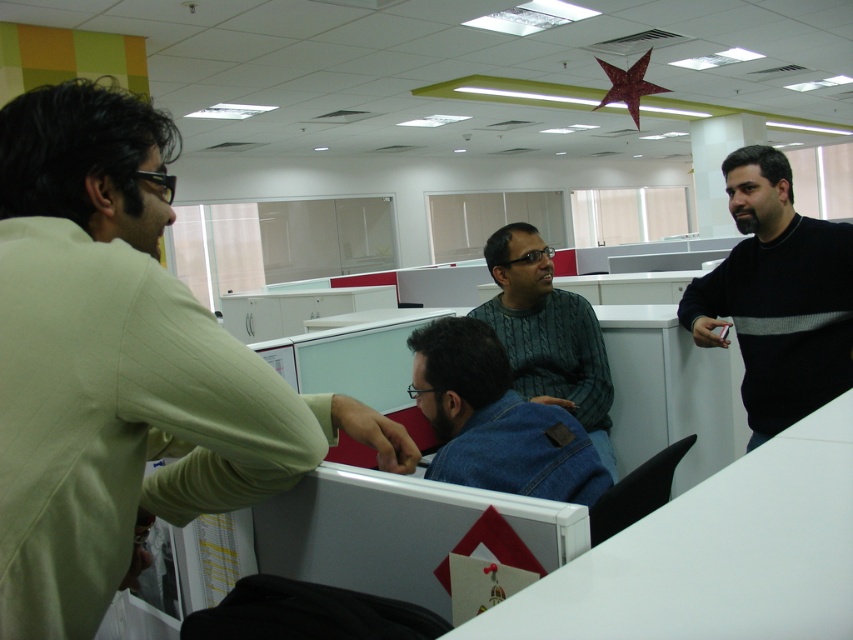
Question: Which of the following is the closest to the observer?

Choices:
 (A) (142, 378)
 (B) (807, 227)

Answer: (A)

Question: Does denim jacket at center appear on the left side of green knitted sweater at center?

Choices:
 (A) no
 (B) yes

Answer: (B)

Question: Which object is the farthest from the black sweater at right?

Choices:
 (A) light beige shirt at left
 (B) green knitted sweater at center

Answer: (A)

Question: In this image, where is light beige shirt at left located relative to denim jacket at center?

Choices:
 (A) below
 (B) above

Answer: (B)

Question: Can you confirm if black sweater at right is positioned to the right of denim jacket at center?

Choices:
 (A) yes
 (B) no

Answer: (A)

Question: Considering the real-world distances, which object is closest to the denim jacket at center?

Choices:
 (A) black sweater at right
 (B) green knitted sweater at center
 (C) light beige shirt at left

Answer: (C)